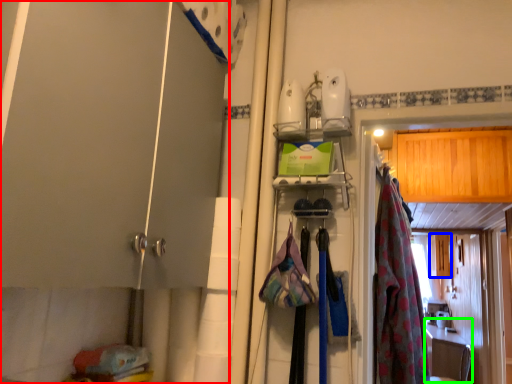
Question: Which is farther away from door (highlighted by a red box)? cabinetry (highlighted by a blue box) or counter top (highlighted by a green box)?

Choices:
 (A) cabinetry
 (B) counter top

Answer: (B)